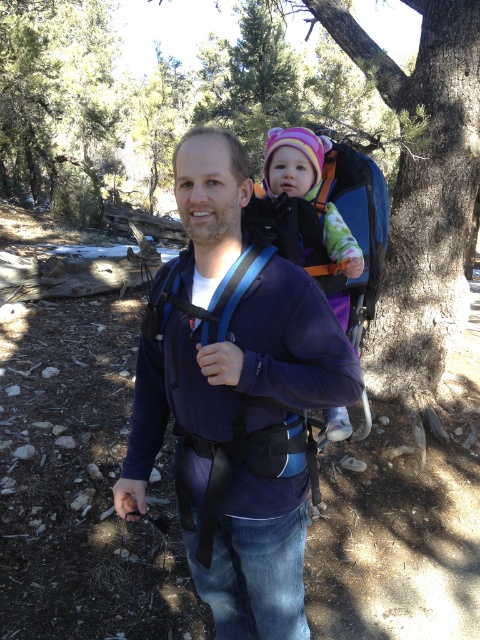
You are a photographer trying to capture a photo of the green leafy tree at upper left and the multicolored fleece hat at center in the same frame. Based on the distance between them, do you think they can be included in a single photo without moving the camera position?

The green leafy tree at upper left and multicolored fleece hat at center are 70.16 feet apart. Depending on the camera lens used, they can potentially be captured in the same frame if a wide enough angle is employed, but the exact feasibility depends on the camera equipment available.